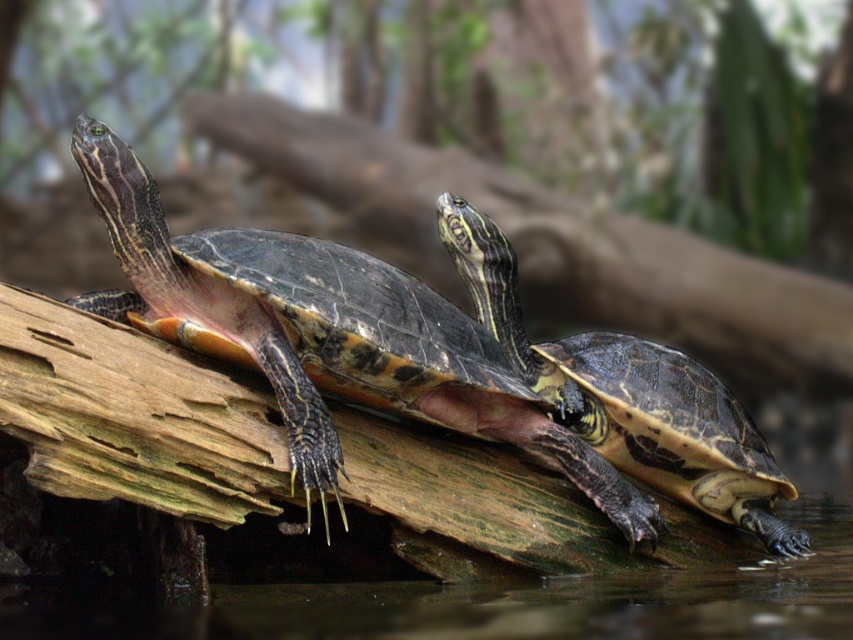
Question: Does shiny black turtle at left have a larger size compared to shiny black turtle at center?

Choices:
 (A) yes
 (B) no

Answer: (A)

Question: Is shiny black turtle at left further to camera compared to shiny black turtle at center?

Choices:
 (A) yes
 (B) no

Answer: (B)

Question: Is shiny black turtle at left thinner than shiny black turtle at center?

Choices:
 (A) no
 (B) yes

Answer: (A)

Question: Which point is farther to the camera?

Choices:
 (A) (107, 182)
 (B) (654, 358)

Answer: (B)